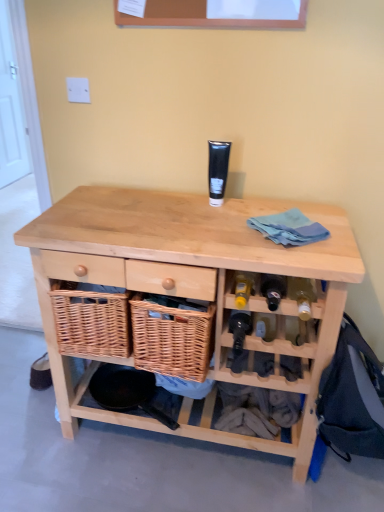
Question: Is translucent glass wine bottle at lower right, which appears as the second wine bottle when viewed from the left, facing away from white painted wood door at left?

Choices:
 (A) yes
 (B) no

Answer: (B)

Question: Does translucent glass wine bottle at lower right, the 1th wine bottle viewed from the right, have a smaller size compared to white painted wood door at left?

Choices:
 (A) no
 (B) yes

Answer: (B)

Question: Are translucent glass wine bottle at lower right, which appears as the second wine bottle when viewed from the left, and white painted wood door at left making contact?

Choices:
 (A) no
 (B) yes

Answer: (A)

Question: Can you confirm if translucent glass wine bottle at lower right, arranged as the second wine bottle when ordered from the bottom, is shorter than white painted wood door at left?

Choices:
 (A) no
 (B) yes

Answer: (B)

Question: Does translucent glass wine bottle at lower right, arranged as the second wine bottle when ordered from the bottom, have a lesser width compared to white painted wood door at left?

Choices:
 (A) yes
 (B) no

Answer: (B)

Question: Is white painted wood door at left spatially inside translucent glass wine bottle at lower right, arranged as the second wine bottle when ordered from the bottom, or outside of it?

Choices:
 (A) outside
 (B) inside

Answer: (A)

Question: Looking at the image, does white painted wood door at left seem bigger or smaller compared to translucent glass wine bottle at lower right, arranged as the second wine bottle when ordered from the bottom?

Choices:
 (A) big
 (B) small

Answer: (A)

Question: From their relative heights in the image, would you say white painted wood door at left is taller or shorter than translucent glass wine bottle at lower right, arranged as the second wine bottle when ordered from the bottom?

Choices:
 (A) short
 (B) tall

Answer: (B)

Question: From the image's perspective, is white painted wood door at left located above or below translucent glass wine bottle at lower right, arranged as the second wine bottle when ordered from the bottom?

Choices:
 (A) below
 (B) above

Answer: (B)

Question: From a real-world perspective, relative to white painted wood door at left, is translucent glass wine bottle at lower right, the 1th wine bottle viewed from the right, vertically above or below?

Choices:
 (A) above
 (B) below

Answer: (B)

Question: Considering the positions of translucent glass wine bottle at lower right, arranged as the second wine bottle when ordered from the bottom, and white painted wood door at left in the image, is translucent glass wine bottle at lower right, arranged as the second wine bottle when ordered from the bottom, taller or shorter than white painted wood door at left?

Choices:
 (A) tall
 (B) short

Answer: (B)

Question: From the image's perspective, is translucent glass wine bottle at lower right, the 1th wine bottle viewed from the right, located above or below white painted wood door at left?

Choices:
 (A) above
 (B) below

Answer: (B)

Question: Visually, is translucent glass wine bottle at lower right, the first wine bottle from the top, positioned to the left or to the right of white painted wood door at left?

Choices:
 (A) right
 (B) left

Answer: (A)

Question: Is translucent glass wine bottle at lower right, the first wine bottle from the top, taller or shorter than black matte tube at center?

Choices:
 (A) short
 (B) tall

Answer: (A)

Question: Is point (307, 305) positioned closer to the camera than point (208, 167)?

Choices:
 (A) closer
 (B) farther

Answer: (A)